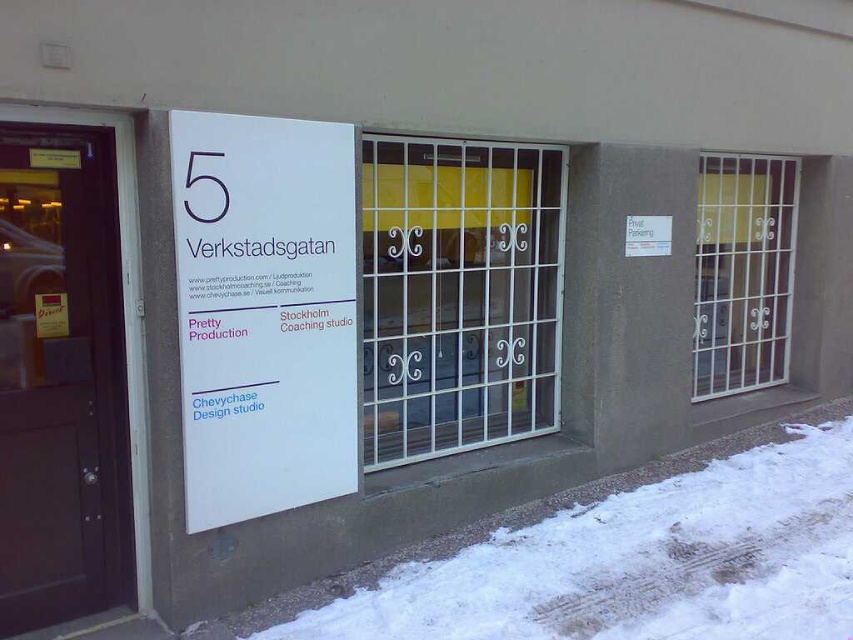
You are standing in front of the building at 5 Verkstadsgatan and notice a point marked at coordinates (641, 563). What is located at that point?

At point (641, 563) lies white powdery snow at lower right.

You are standing in front of the building and want to walk towards the white metal gate at center. Which direction should you move relative to the white powdery snow at lower right?

You should move to the left relative to the white powdery snow at lower right because the white metal gate at center is to the left of the white powdery snow at lower right.

You are standing in front of the building and want to read the white paper sign at center. There is white powdery snow at lower right nearby. Which object is wider so that you can step on it to reach the sign?

The white powdery snow at lower right is wider than the white paper sign at center, so you can step on the white powdery snow at lower right to reach the sign.